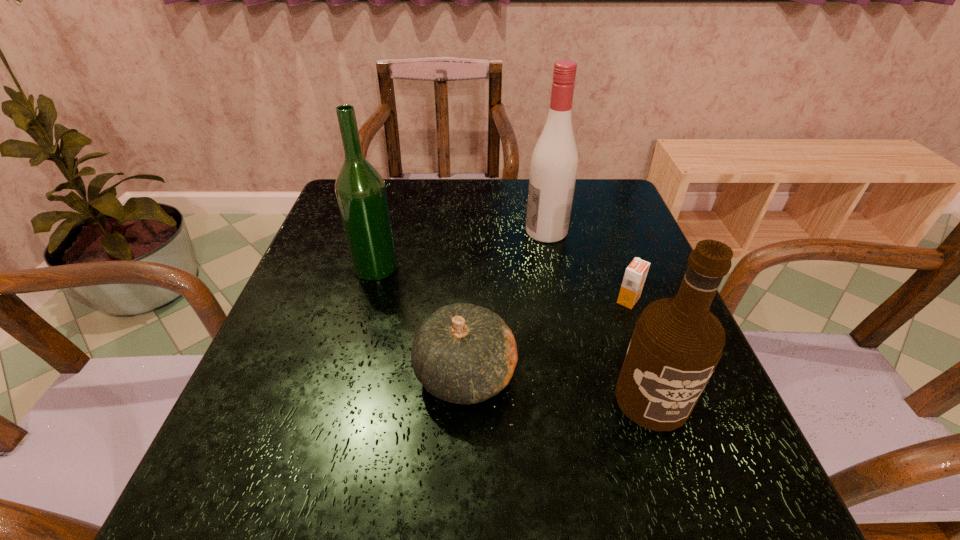
Image resolution: width=960 pixels, height=540 pixels. I want to click on vacant space located on the label of the farthest object, so pos(403,231).

Find the location of a particular element. free space located 0.210m on the label of the farthest object is located at coordinates click(443, 231).

You are a GUI agent. You are given a task and a screenshot of the screen. Output one action in this format:
    pyautogui.click(x=<x>, y=<y>)
    Task: Click on the free space located on the label of the farthest object
    
    Given the screenshot: What is the action you would take?
    pyautogui.click(x=427, y=231)

Identify the location of vacant space located 0.120m on the left of the leftmost object. (302, 267).

This screenshot has width=960, height=540. What are the coordinates of `free region located 0.120m on the label of the nearest alcohol` in the screenshot? It's located at (689, 510).

Find the location of `free space located 0.140m on the back of the gourd`. free space located 0.140m on the back of the gourd is located at coordinates (468, 287).

Identify the location of free space located 0.400m on the left of the shortest object. The height and width of the screenshot is (540, 960). (427, 300).

I want to click on object present at the far edge, so click(x=554, y=163).

Where is `object that is positioned at the left edge`? This screenshot has height=540, width=960. object that is positioned at the left edge is located at coordinates (360, 190).

Locate an element on the screen. alcohol situated at the right edge is located at coordinates (677, 342).